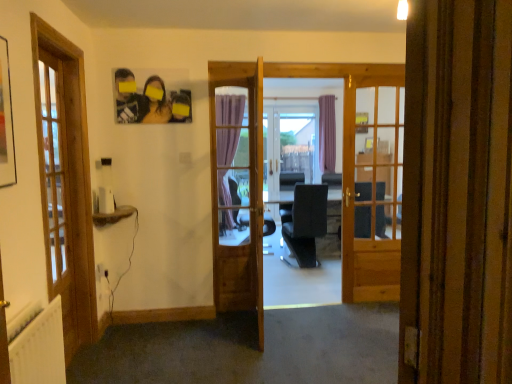
Describe the element at coordinates (231, 187) in the screenshot. I see `wooden door at center` at that location.

The height and width of the screenshot is (384, 512). I want to click on white textured radiator at lower left, so click(40, 349).

Where is `white plastic screen door at center`? Image resolution: width=512 pixels, height=384 pixels. white plastic screen door at center is located at coordinates (290, 146).

The width and height of the screenshot is (512, 384). Identify the location of wooden door at center. (231, 187).

Can you confirm if wooden door at center is shorter than white textured radiator at lower left?

No, wooden door at center is not shorter than white textured radiator at lower left.

From the image's perspective, which is below, wooden door at center or white textured radiator at lower left?

white textured radiator at lower left, from the image's perspective.

Is white textured radiator at lower left inside wooden door at center?

No, white textured radiator at lower left is not surrounded by wooden door at center.

Could you tell me if wooden door at center is turned towards white textured radiator at lower left?

No, wooden door at center is not facing towards white textured radiator at lower left.

How different are the orientations of white textured radiator at lower left and wooden door at center in degrees?

white textured radiator at lower left and wooden door at center are facing 89.5 degrees away from each other.

From the image's perspective, does white textured radiator at lower left appear higher than wooden door at center?

No, from the image's perspective, white textured radiator at lower left is not above wooden door at center.

Considering the sizes of objects white textured radiator at lower left and wooden door at center in the image provided, who is thinner, white textured radiator at lower left or wooden door at center?

With smaller width is wooden door at center.

From a real-world perspective, between white textured radiator at lower left and wooden door at center, who is vertically lower?

From a 3D spatial view, white textured radiator at lower left is below.

Is white textured radiator at lower left bigger than white plastic screen door at center?

No.

At what (x,y) coordinates should I click in order to perform the action: click on screen door that appears behind the white textured radiator at lower left. Please return your answer as a coordinate pair (x, y). This screenshot has width=512, height=384. Looking at the image, I should click on (290, 146).

Is white textured radiator at lower left with white plastic screen door at center?

white textured radiator at lower left is not next to white plastic screen door at center, and they're not touching.

Considering the relative sizes of white textured radiator at lower left and white plastic screen door at center in the image provided, is white textured radiator at lower left thinner than white plastic screen door at center?

Correct, the width of white textured radiator at lower left is less than that of white plastic screen door at center.

Which of these two, white plastic screen door at center or wooden door at center, is bigger?

white plastic screen door at center is bigger.

From their relative heights in the image, would you say white plastic screen door at center is taller or shorter than wooden door at center?

In the image, white plastic screen door at center appears to be taller than wooden door at center.

Is white plastic screen door at center looking in the opposite direction of wooden door at center?

No.

Considering the relative sizes of white plastic screen door at center and wooden door at center in the image provided, is white plastic screen door at center wider than wooden door at center?

Indeed, white plastic screen door at center has a greater width compared to wooden door at center.

Is wooden door at center taller than white plastic screen door at center?

No.

In the scene shown: Is wooden door at center facing away from white plastic screen door at center?

No, white plastic screen door at center is not at the back of wooden door at center.

Would you say wooden door at center is inside or outside white plastic screen door at center?

wooden door at center is not enclosed by white plastic screen door at center.

Could you tell me if white plastic screen door at center is facing white textured radiator at lower left?

No, white plastic screen door at center is not aimed at white textured radiator at lower left.

How different are the orientations of white plastic screen door at center and white textured radiator at lower left in degrees?

92.9 degrees separate the facing orientations of white plastic screen door at center and white textured radiator at lower left.

Is white plastic screen door at center outside of white textured radiator at lower left?

white plastic screen door at center is positioned outside white textured radiator at lower left.

Considering the positions of objects white plastic screen door at center and white textured radiator at lower left in the image provided, who is more to the left, white plastic screen door at center or white textured radiator at lower left?

Positioned to the left is white textured radiator at lower left.

This screenshot has width=512, height=384. I want to click on door behind the white textured radiator at lower left, so click(x=231, y=187).

Find the location of a particular element. The height and width of the screenshot is (384, 512). radiator that is under the wooden door at center (from a real-world perspective) is located at coordinates (40, 349).

Based on their spatial positions, is wooden door at center or white plastic screen door at center further from white textured radiator at lower left?

Among the two, white plastic screen door at center is located further to white textured radiator at lower left.

From the image, which object appears to be nearer to wooden door at center, white textured radiator at lower left or white plastic screen door at center?

white textured radiator at lower left lies closer to wooden door at center than the other object.

Considering their positions, is white textured radiator at lower left positioned closer to white plastic screen door at center than wooden door at center?

wooden door at center lies closer to white plastic screen door at center than the other object.

From the image, which object appears to be nearer to wooden door at center, white plastic screen door at center or white textured radiator at lower left?

Based on the image, white textured radiator at lower left appears to be nearer to wooden door at center.

Estimate the real-world distances between objects in this image. Which object is further from white plastic screen door at center, wooden door at center or white textured radiator at lower left?

white textured radiator at lower left.

Considering their positions, is white plastic screen door at center positioned further to white textured radiator at lower left than wooden door at center?

The object further to white textured radiator at lower left is white plastic screen door at center.

Where is `door located between white textured radiator at lower left and white plastic screen door at center in the depth direction`? The height and width of the screenshot is (384, 512). door located between white textured radiator at lower left and white plastic screen door at center in the depth direction is located at coordinates (231, 187).